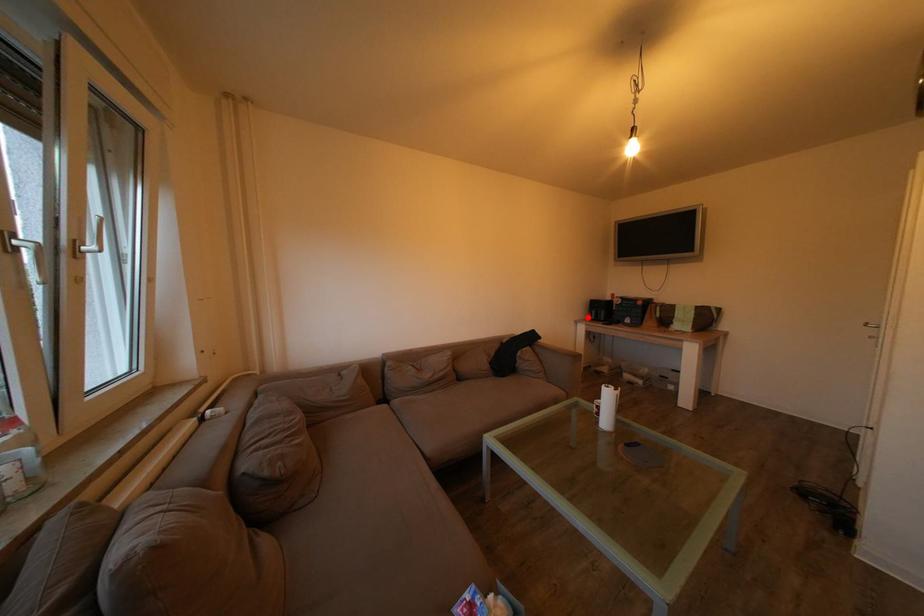
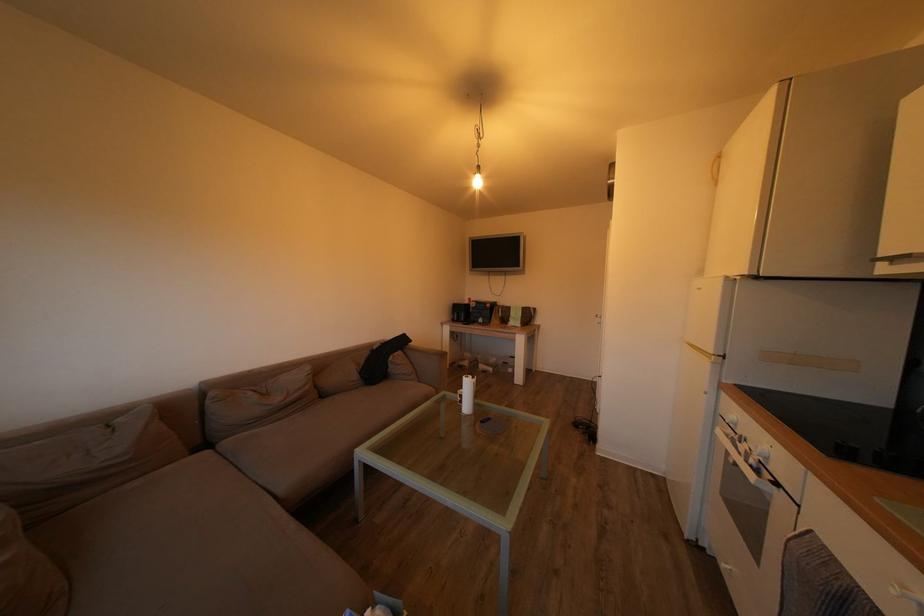
The point at the highlighted location is marked in the first image. Where is the corresponding point in the second image?

(453, 320)